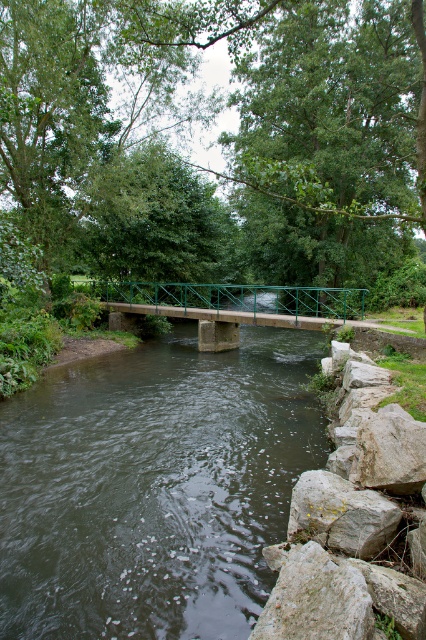
Is point (83, 458) positioned behind point (308, 564)?

That is True.

Who is more forward, (256, 346) or (298, 624)?

Positioned in front is point (298, 624).

Where is `dark green water at center`? The height and width of the screenshot is (640, 426). dark green water at center is located at coordinates (154, 486).

Find the location of a particular element. The width and height of the screenshot is (426, 640). dark green water at center is located at coordinates (154, 486).

Is point (134, 282) behind point (368, 515)?

Yes, it is.

Does point (244, 307) come behind point (299, 524)?

Yes, it is.

This screenshot has width=426, height=640. In order to click on green metal bridge at center in this screenshot , I will do `click(239, 298)`.

Who is positioned more to the left, green leafy tree at center or green metal bridge at center?

Positioned to the left is green metal bridge at center.

Is green leafy tree at center to the left of green metal bridge at center from the viewer's perspective?

In fact, green leafy tree at center is to the right of green metal bridge at center.

This screenshot has width=426, height=640. Describe the element at coordinates (221, 140) in the screenshot. I see `green leafy tree at center` at that location.

Locate an element on the screen. The height and width of the screenshot is (640, 426). green leafy tree at center is located at coordinates (221, 140).